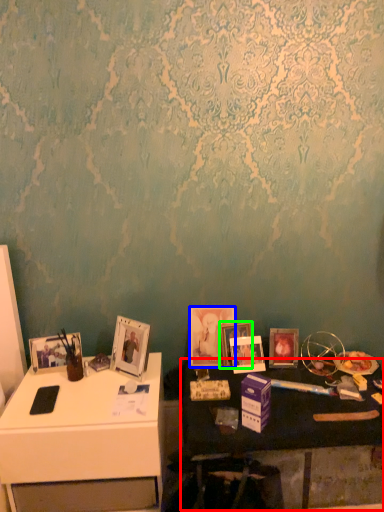
Question: Estimate the real-world distances between objects in this image. Which object is closer to table (highlighted by a red box), picture frame (highlighted by a blue box) or picture frame (highlighted by a green box)?

Choices:
 (A) picture frame
 (B) picture frame

Answer: (A)